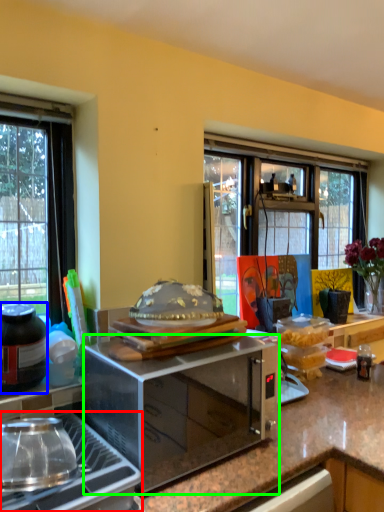
Question: Estimate the real-world distances between objects in this image. Which object is closer to gas stove (highlighted by a red box), bottle (highlighted by a blue box) or microwave oven (highlighted by a green box)?

Choices:
 (A) bottle
 (B) microwave oven

Answer: (B)